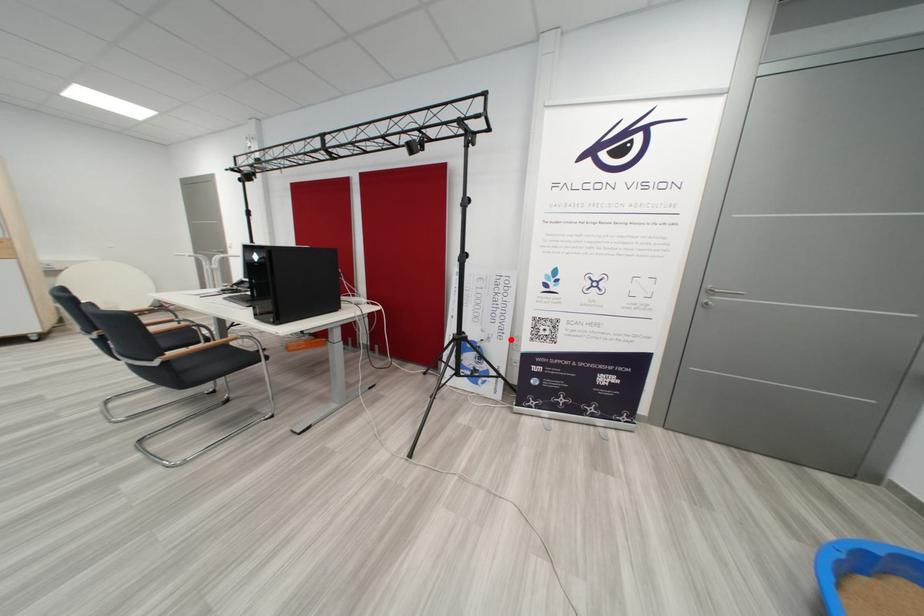
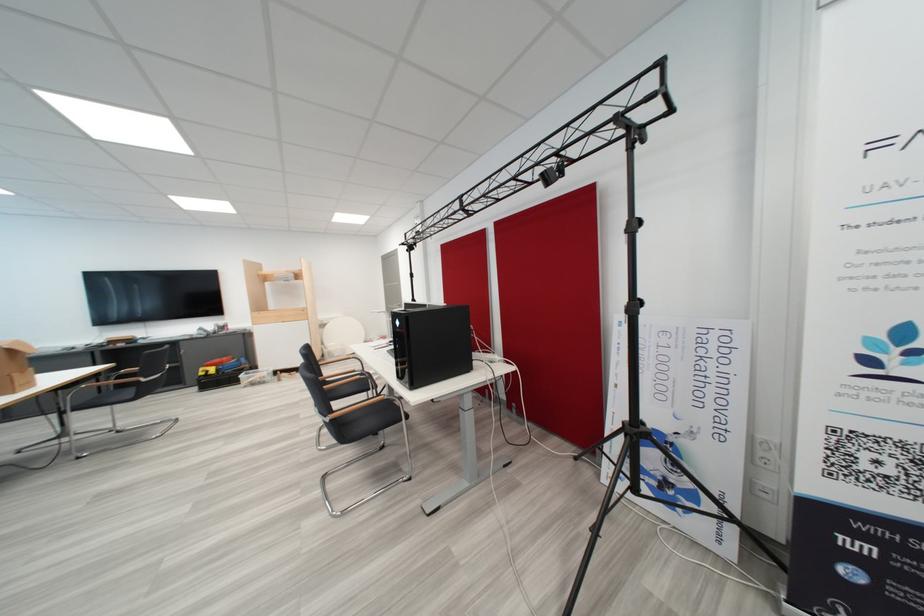
In the second image, find the point that corresponds to the highlighted location in the first image.

(731, 439)